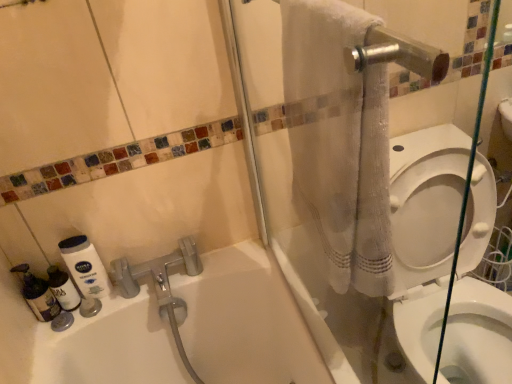
Question: Does white matte lotion at lower left, which is the first cleaning product from right to left, have a greater height compared to white textured towel at upper right?

Choices:
 (A) yes
 (B) no

Answer: (B)

Question: Could white textured towel at upper right be considered to be inside white matte lotion at lower left, which ranks as the 3th cleaning product in left-to-right order?

Choices:
 (A) no
 (B) yes

Answer: (A)

Question: Is white matte lotion at lower left, which is the first cleaning product from right to left, turned away from white textured towel at upper right?

Choices:
 (A) no
 (B) yes

Answer: (A)

Question: Could you tell me if white matte lotion at lower left, which is the first cleaning product from right to left, is facing white textured towel at upper right?

Choices:
 (A) no
 (B) yes

Answer: (A)

Question: Does white matte lotion at lower left, which ranks as the 3th cleaning product in left-to-right order, have a greater width compared to white textured towel at upper right?

Choices:
 (A) no
 (B) yes

Answer: (A)

Question: Is white textured towel at upper right in front of or behind translucent plastic bottles at lower left, marked as the 3th cleaning product in a right-to-left arrangement, in the image?

Choices:
 (A) behind
 (B) front

Answer: (B)

Question: In the image, is white textured towel at upper right on the left side or the right side of translucent plastic bottles at lower left, marked as the 3th cleaning product in a right-to-left arrangement?

Choices:
 (A) left
 (B) right

Answer: (B)

Question: Do you think white textured towel at upper right is within translucent plastic bottles at lower left, the first cleaning product viewed from the left, or outside of it?

Choices:
 (A) inside
 (B) outside

Answer: (B)

Question: Is point (308, 190) closer or farther from the camera than point (23, 279)?

Choices:
 (A) farther
 (B) closer

Answer: (B)

Question: In terms of height, does translucent plastic bottles at lower left, the first cleaning product viewed from the left, look taller or shorter compared to white textured towel at upper right?

Choices:
 (A) tall
 (B) short

Answer: (B)

Question: Based on their positions, is translucent plastic bottles at lower left, marked as the 3th cleaning product in a right-to-left arrangement, located to the left or right of white textured towel at upper right?

Choices:
 (A) right
 (B) left

Answer: (B)

Question: Is point (29, 266) positioned closer to the camera than point (340, 142)?

Choices:
 (A) farther
 (B) closer

Answer: (A)

Question: Is translucent plastic bottles at lower left, the first cleaning product viewed from the left, wider or thinner than white textured towel at upper right?

Choices:
 (A) wide
 (B) thin

Answer: (B)

Question: Is translucent plastic bottle at lower left, the second cleaning product when ordered from right to left, inside the boundaries of white glossy toilet at right, or outside?

Choices:
 (A) outside
 (B) inside

Answer: (A)

Question: Is translucent plastic bottle at lower left, acting as the second cleaning product starting from the left, wider or thinner than white glossy toilet at right?

Choices:
 (A) thin
 (B) wide

Answer: (A)